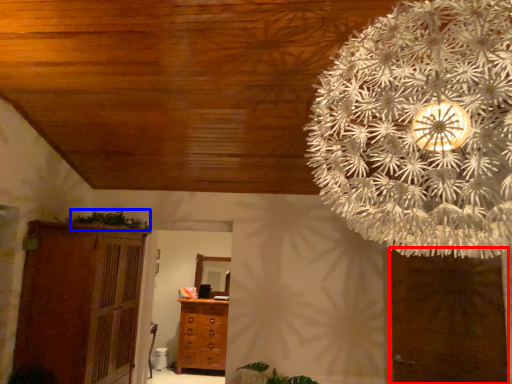
Question: Which point is closer to the camera, door (highlighted by a red box) or plant (highlighted by a blue box)?

Choices:
 (A) door
 (B) plant

Answer: (A)